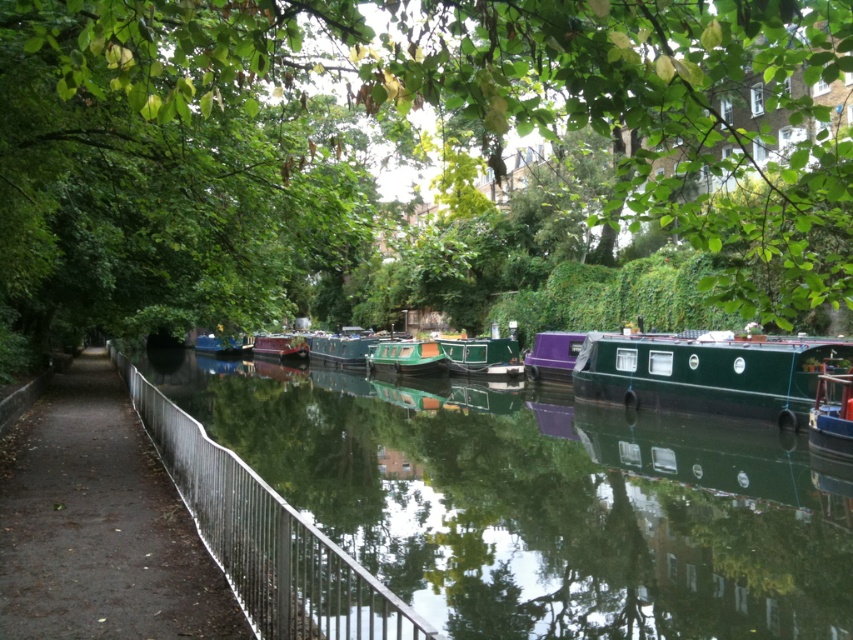
You are standing on the pathway next to the canal and want to take a photo of the point at coordinates (363, 346). If your camera has a maximum focus range of 40 meters, will you be able to focus on that point?

The point at coordinates (363, 346) is 44.32 meters away from the camera. Since the camera can only focus up to 40 meters, it won not be able to focus on that point.

You are a tourist standing on the pathway and want to take a photo of the shiny purple boat at center. The silver metallic fence at center is in your way. Can you move to the side to avoid the fence and still see the boat?

The silver metallic fence at center is closer to the viewer than shiny purple boat at center, so moving to the side might allow you to see around the fence and still view the shiny purple boat at center.

You are standing on the paved pathway next to the canal and want to board the green glossy barge at center. Based on its position, which direction should you walk along the pathway to reach it?

The green glossy barge at center is located at point coordinates, so you should walk along the pathway towards the center to reach it.